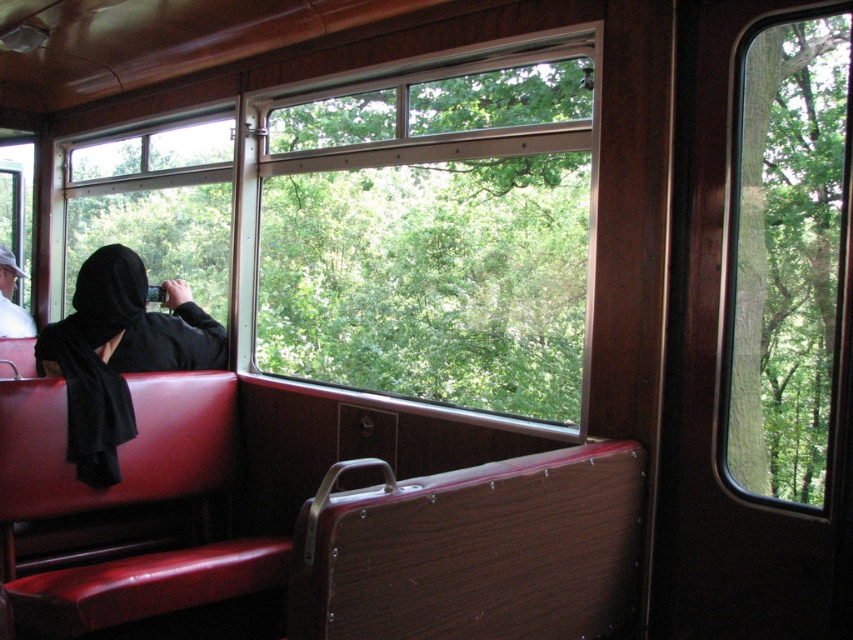
You are inside the vintage train car and want to take a photo through the clear glass window at center. Where exactly should you position yourself to ensure the window is in the best possible frame for your shot?

The clear glass window at center is located at point (x=433, y=230), so you should position yourself directly in front of this coordinate to ensure the window is centered and optimally framed for your photograph.

You are a passenger on this vintage train car and want to take a photo through the transparent glass window at right while wearing the black matte robe at center. Can you position yourself so that the robe doesn not block the window?

The transparent glass window at right is to the right of the black matte robe at center, so you can move to the left side of the robe to take the photo without the robe blocking the window.

You are a photographer inside the vintage train car. You want to take a photo through the clear glass window at center, but you are wearing the black matte robe at center. Will your robe interfere with the photo if you extend your arm fully?

The clear glass window at center is 2.50 meters away from the black matte robe at center. Since the robe is 2.50 meters away from the window, extending your arm fully should allow you to reach the window without the robe blocking the shot.